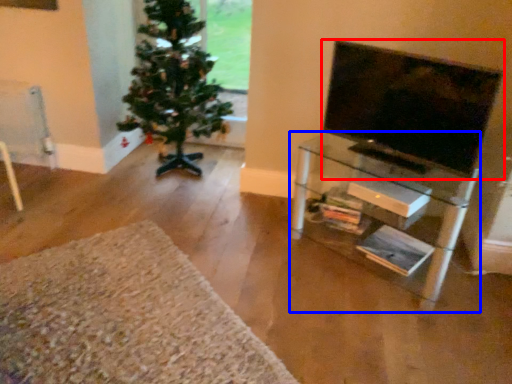
Question: Which of the following is the closest to the observer, television (highlighted by a red box) or shelf (highlighted by a blue box)?

Choices:
 (A) television
 (B) shelf

Answer: (A)